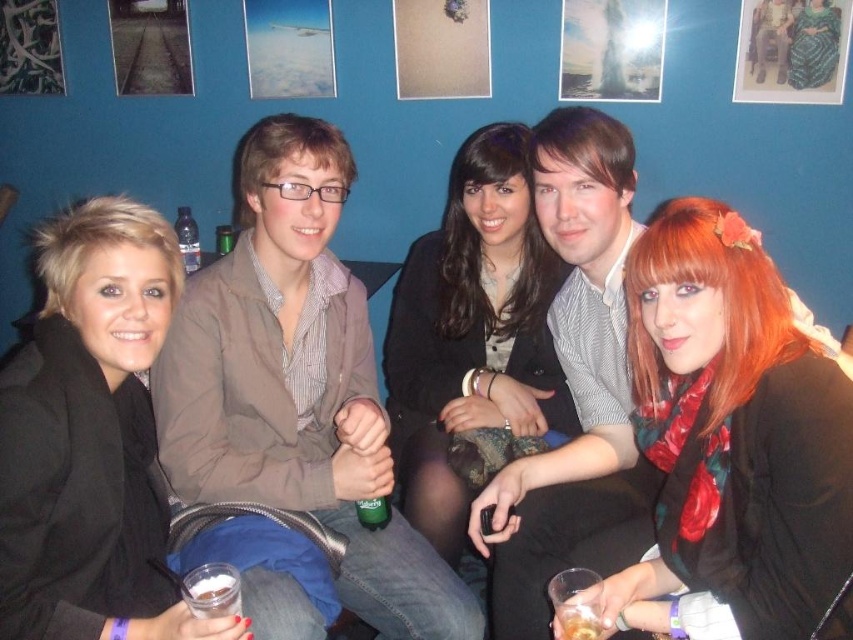
You are organizing a clothing donation drive and need to determine if the brown cotton jacket at center and the floral scarf at center can fit into a standard donation box that measures 30 cm in width. Given their sizes, will both items fit side by side?

The brown cotton jacket at center is wider than the floral scarf at center. However, since the combined width of both items would exceed the 30 cm donation box, they cannot fit side by side.

You are a delivery person trying to place a small package between the brown cotton jacket at center and the black matte jacket at left. Can you fit the package without moving either jacket?

The distance between the brown cotton jacket at center and the black matte jacket at left is 10.01 inches. Since the package is small, it should fit comfortably in the space provided.